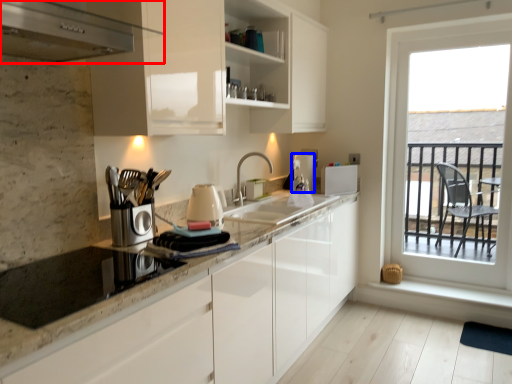
Question: Which object appears farthest to the camera in this image, kitchen appliance (highlighted by a red box) or appliance (highlighted by a blue box)?

Choices:
 (A) kitchen appliance
 (B) appliance

Answer: (B)